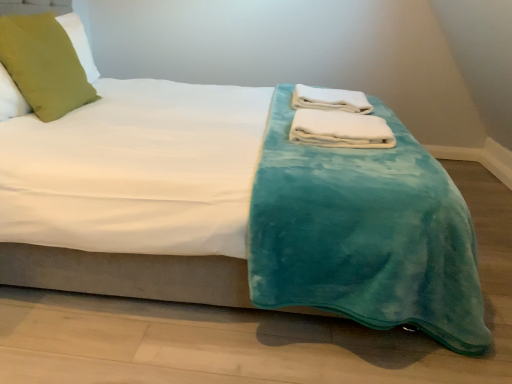
Question: Considering the relative positions of green fabric pillow at upper left and white soft towel at center, the second bath towel from the front, in the image provided, is green fabric pillow at upper left to the left or to the right of white soft towel at center, the second bath towel from the front,?

Choices:
 (A) right
 (B) left

Answer: (B)

Question: In terms of width, does green fabric pillow at upper left look wider or thinner when compared to white soft towel at center, positioned as the 1th bath towel in top-to-bottom order?

Choices:
 (A) thin
 (B) wide

Answer: (A)

Question: Based on their relative distances, which object is nearer to the white soft towel at center, positioned as the first bath towel in front-to-back order?

Choices:
 (A) white soft towel at center, positioned as the 1th bath towel in top-to-bottom order
 (B) green fabric pillow at upper left

Answer: (A)

Question: Which object is positioned closest to the white soft towel at center, the second bath towel from the front?

Choices:
 (A) white soft towel at center, which is counted as the 2th bath towel, starting from the back
 (B) green fabric pillow at upper left

Answer: (A)